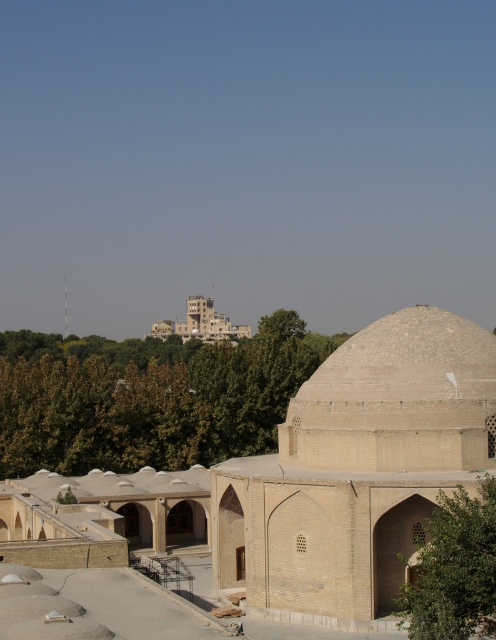
Question: Does green leafy tree at center have a larger size compared to beige stone dome at lower right?

Choices:
 (A) no
 (B) yes

Answer: (B)

Question: Can you confirm if beige stone dome at lower right is bigger than green leafy tree at lower right?

Choices:
 (A) yes
 (B) no

Answer: (A)

Question: Which object appears farthest from the camera in this image?

Choices:
 (A) beige stone dome at lower right
 (B) green leafy tree at center
 (C) beige brick mosque at center
 (D) green leafy tree at lower right

Answer: (B)

Question: Is beige brick mosque at center in front of beige stone dome at lower right?

Choices:
 (A) no
 (B) yes

Answer: (B)

Question: Estimate the real-world distances between objects in this image. Which object is farther from the green leafy tree at lower right?

Choices:
 (A) green leafy tree at center
 (B) beige brick mosque at center

Answer: (A)

Question: Which of these objects is positioned closest to the green leafy tree at lower right?

Choices:
 (A) beige stone dome at lower right
 (B) beige brick mosque at center
 (C) green leafy tree at center

Answer: (A)